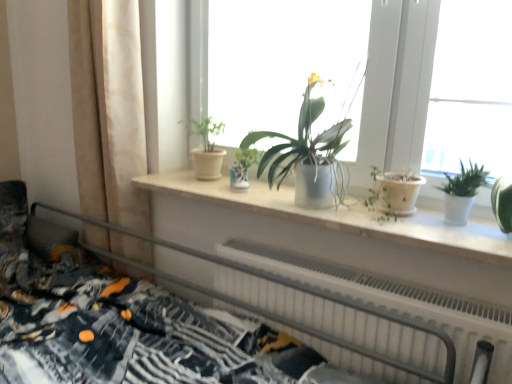
Where is `free space above white matte window sill at center (from a real-world perspective)`? The width and height of the screenshot is (512, 384). free space above white matte window sill at center (from a real-world perspective) is located at coordinates (322, 204).